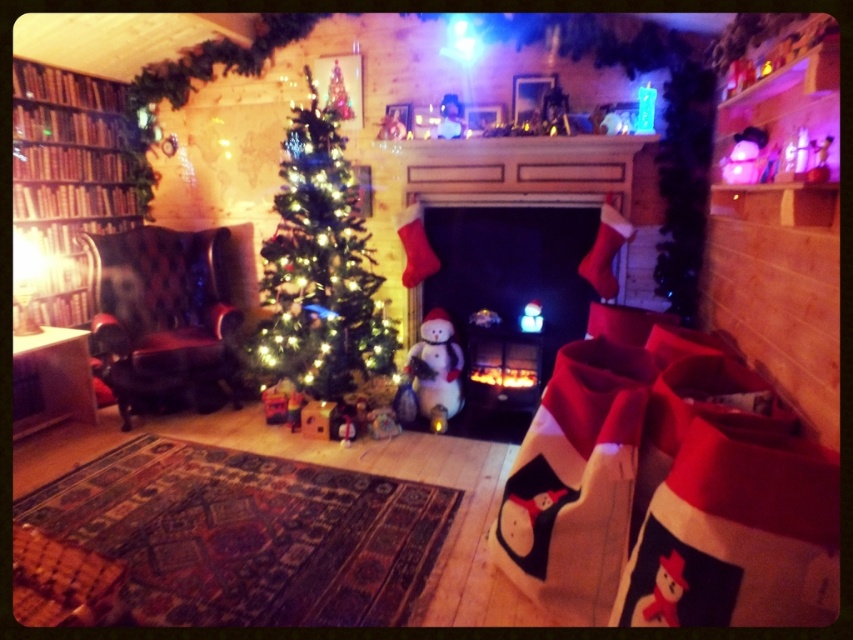
Question: Based on their relative distances, which object is farther from the green matte christmas tree at center?

Choices:
 (A) leather wingback chair at left
 (B) wooden bookshelf at left
 (C) black glossy fireplace at center
 (D) white matte snowman at center

Answer: (B)

Question: Which of the following is the farthest from the observer?

Choices:
 (A) (421, 355)
 (B) (310, 228)

Answer: (A)

Question: Is green matte christmas tree at center to the right of white matte snowman at center from the viewer's perspective?

Choices:
 (A) yes
 (B) no

Answer: (B)

Question: Is green matte christmas tree at center bigger than leather wingback chair at left?

Choices:
 (A) yes
 (B) no

Answer: (A)

Question: Is green matte christmas tree at center smaller than leather wingback chair at left?

Choices:
 (A) yes
 (B) no

Answer: (B)

Question: Estimate the real-world distances between objects in this image. Which object is farther from the leather wingback chair at left?

Choices:
 (A) green matte christmas tree at center
 (B) white matte snowman at center
 (C) wooden bookshelf at left
 (D) black glossy fireplace at center

Answer: (D)